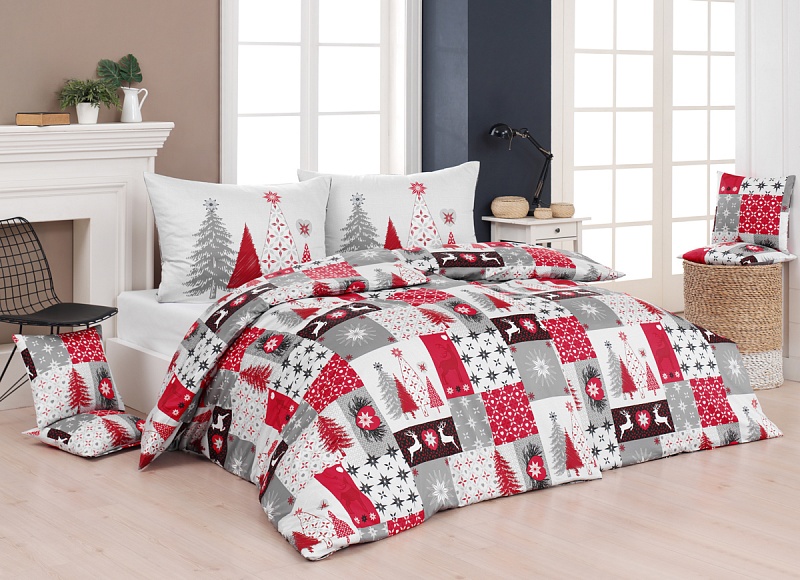
Identify the location of basket. The image size is (800, 580). (772, 310).